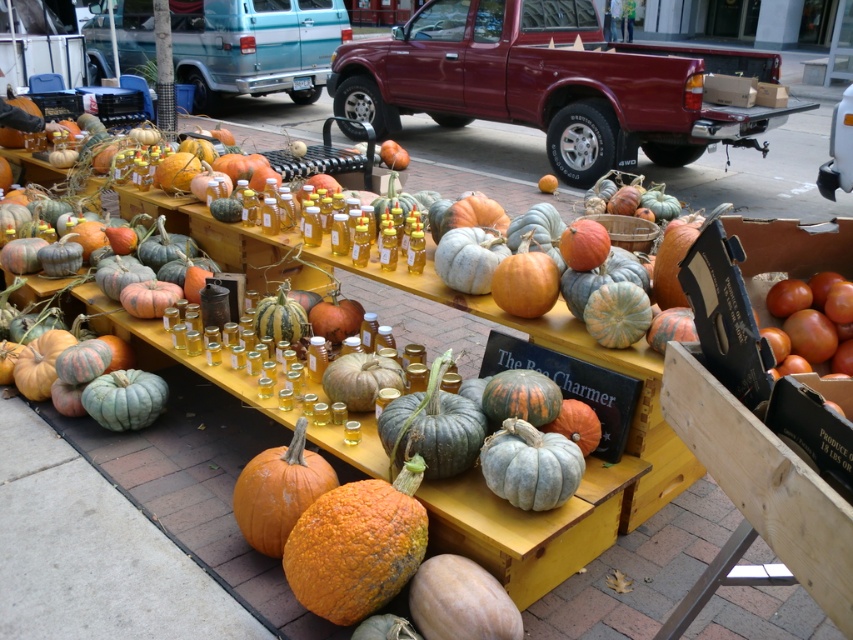
You are a customer at the market and want to place a jar of honey from the small glass jars on the orange rough pumpkin at center. Can you reach the pumpkin without moving the jars?

The distance between the small glass jars and the orange rough pumpkin at center is 4.95 feet, so you can easily reach the pumpkin without moving the jars.